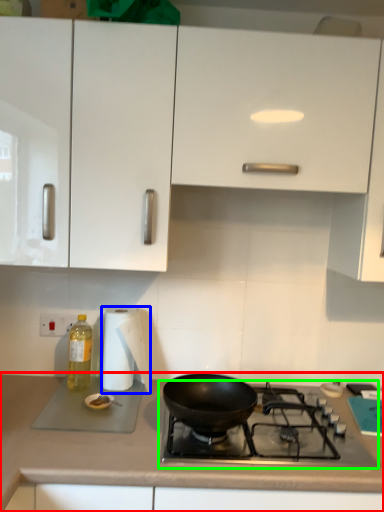
Question: Which object is positioned closest to countertop (highlighted by a red box)? Select from paper towel (highlighted by a blue box) and gas stove (highlighted by a green box).

Choices:
 (A) paper towel
 (B) gas stove

Answer: (B)